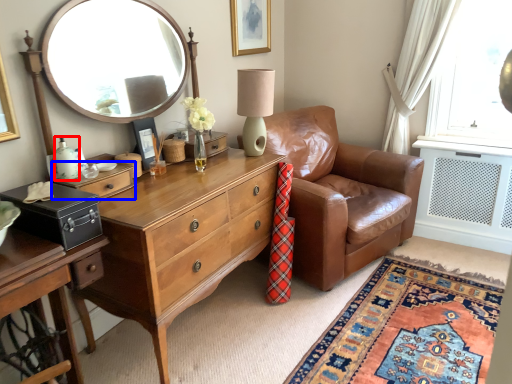
Question: Which object is closer to the camera taking this photo, bottle (highlighted by a red box) or drawer (highlighted by a blue box)?

Choices:
 (A) bottle
 (B) drawer

Answer: (A)